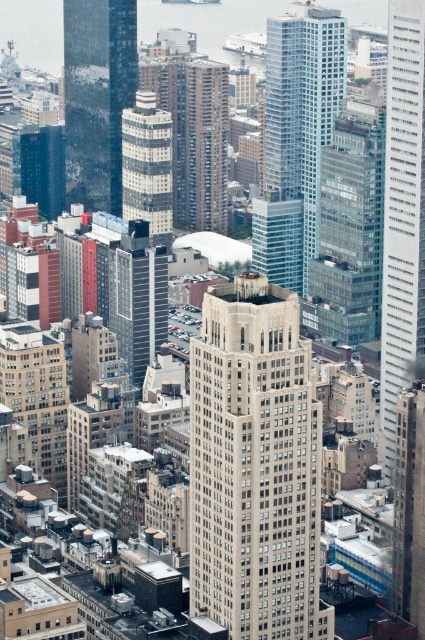
Question: Considering the real-world distances, which object is farthest from the beige stone building at center?

Choices:
 (A) glassy steel skyscraper at center
 (B) metallic glass tower at center

Answer: (B)

Question: Which object is closer to the camera taking this photo?

Choices:
 (A) reflective glass skyscraper at center-left
 (B) glassy steel skyscraper at center
 (C) glassy reflective skyscraper at center
 (D) metallic glass tower at center

Answer: (B)

Question: Is glassy blue skyscraper at center thinner than glassy steel skyscraper at center?

Choices:
 (A) yes
 (B) no

Answer: (B)

Question: Does smooth glass skyscraper at right have a larger size compared to glassy reflective skyscraper at center?

Choices:
 (A) no
 (B) yes

Answer: (B)

Question: Which point appears farthest from the camera in this image?

Choices:
 (A) (87, 115)
 (B) (136, 108)
 (C) (367, 115)
 (D) (391, 42)

Answer: (D)

Question: Is glassy blue skyscraper at center bigger than reflective glass skyscraper at center-left?

Choices:
 (A) no
 (B) yes

Answer: (B)